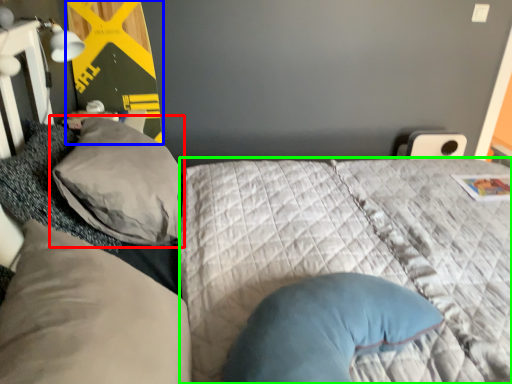
Question: Which object is the farthest from pillow (highlighted by a red box)? Choose among these: bulletin board (highlighted by a blue box) or mattress (highlighted by a green box).

Choices:
 (A) bulletin board
 (B) mattress

Answer: (A)